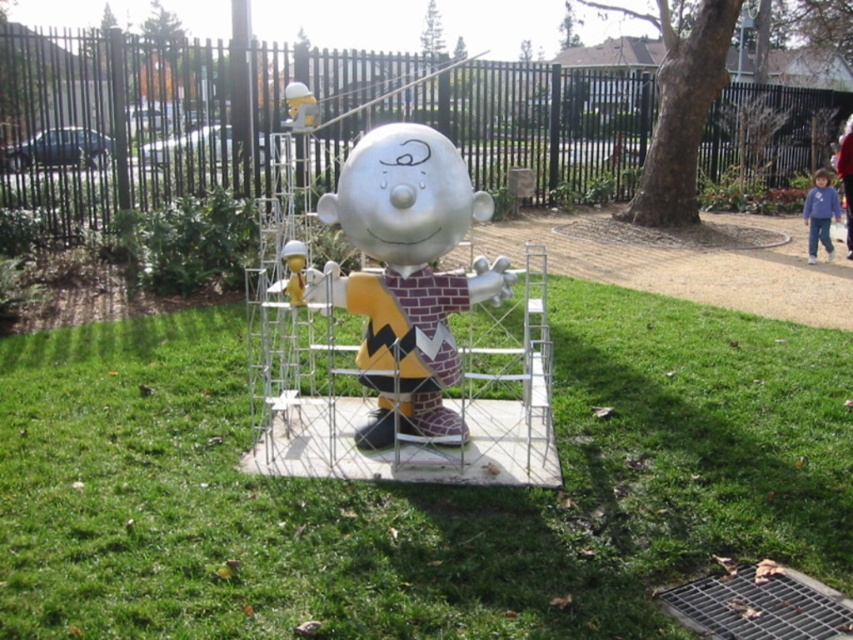
Question: Does green grass at center come behind metallic silver statue at center?

Choices:
 (A) no
 (B) yes

Answer: (A)

Question: Which object appears farthest from the camera in this image?

Choices:
 (A) metallic silver statue at center
 (B) green grass at center

Answer: (A)

Question: Is green grass at center positioned before metallic silver statue at center?

Choices:
 (A) no
 (B) yes

Answer: (B)

Question: Does green grass at center have a larger size compared to metallic silver statue at center?

Choices:
 (A) yes
 (B) no

Answer: (A)

Question: Which point is closer to the camera taking this photo?

Choices:
 (A) (462, 552)
 (B) (463, 205)

Answer: (A)